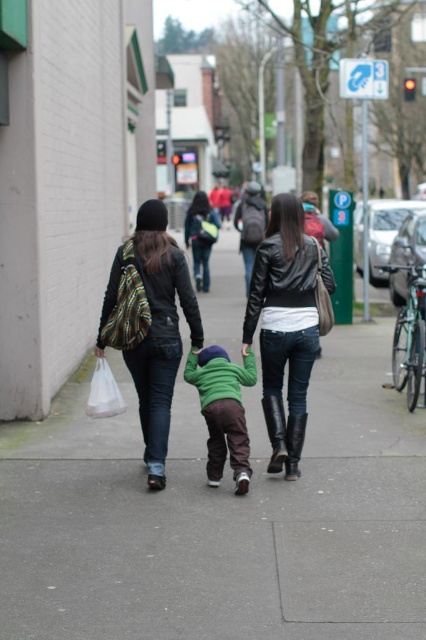
You are a photographer standing on the sidewalk and want to take a photo that includes both the point at (193, 342) and the point at (199, 360). Which point is closer to your camera?

The point at (193, 342) is closer to the camera than the point at (199, 360) because it is further to the camera than the other point.